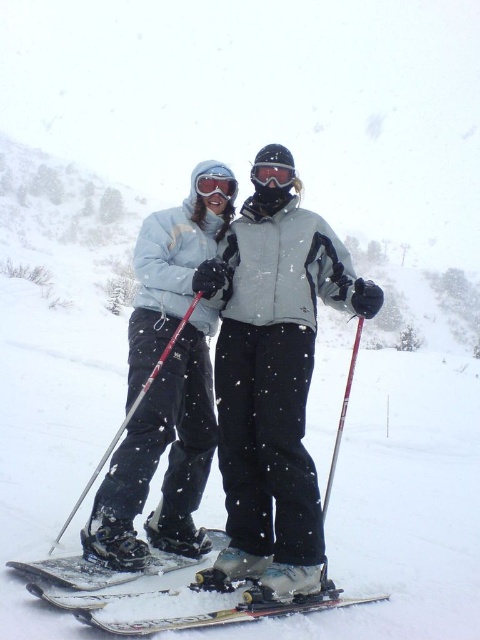
You are a photographer standing at the base of the slope. You want to take a photo of both the point at (228, 611) and the point at (279, 180). Which point should you focus on first to ensure both are in the frame?

You should focus on the point at (279, 180) first because it is behind the other point. By focusing on the farther point, you can ensure both are within the frame.

You are a photographer trying to capture a clear shot of the matte gray ski jacket at center and the metallic silver ski pole at center. Which object should you focus on first if you want to ensure both are in focus, considering their positions?

The matte gray ski jacket at center is positioned on the right side of the metallic silver ski pole at center. Since they are both at the same distance from the camera, focusing on either one should keep both in focus.

You are a photographer trying to capture a clear shot of the matte gray ski jacket at center and the metallic silver ski pole at center. Which object should you focus on first to ensure it appears sharp in the foreground?

The matte gray ski jacket at center should be focused on first because it is positioned over the metallic silver ski pole at center, making it closer to the camera and thus the foreground.